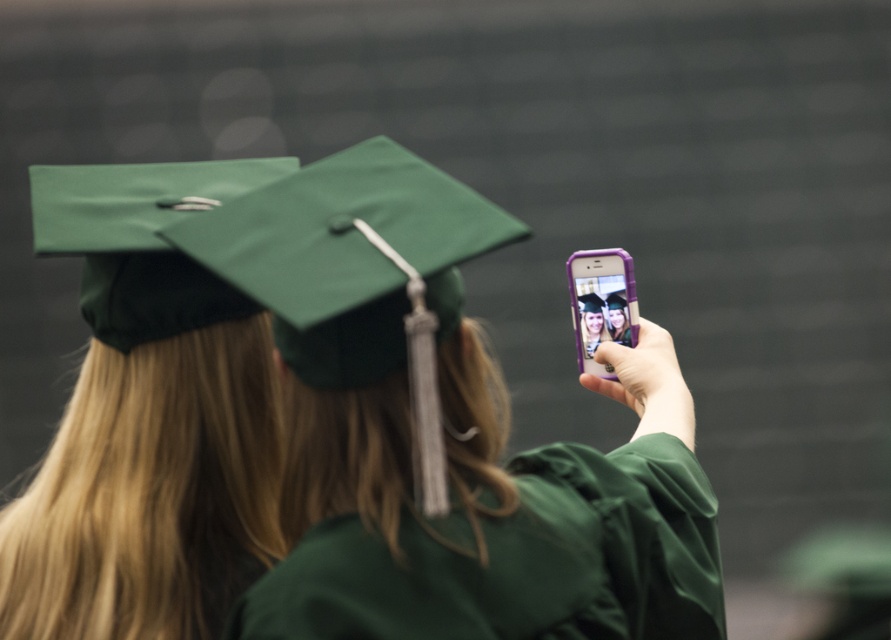
You are standing in the graduation ceremony scene. There is a point marked at coordinates (447, 433). What object is located at that point?

The point at coordinates (447, 433) marks the green matte graduation cap at center.

You are a photographer at the graduation ceremony. You need to frame a photo that includes both the green matte graduation cap at center and the green matte graduation robe at center. Based on their sizes, which object should you ensure is placed closer to the camera to maintain visibility of both?

The green matte graduation cap at center is wider than the green matte graduation robe at center. To ensure both are visible, place the green matte graduation cap at center closer to the camera since its larger size might require more space in the frame.